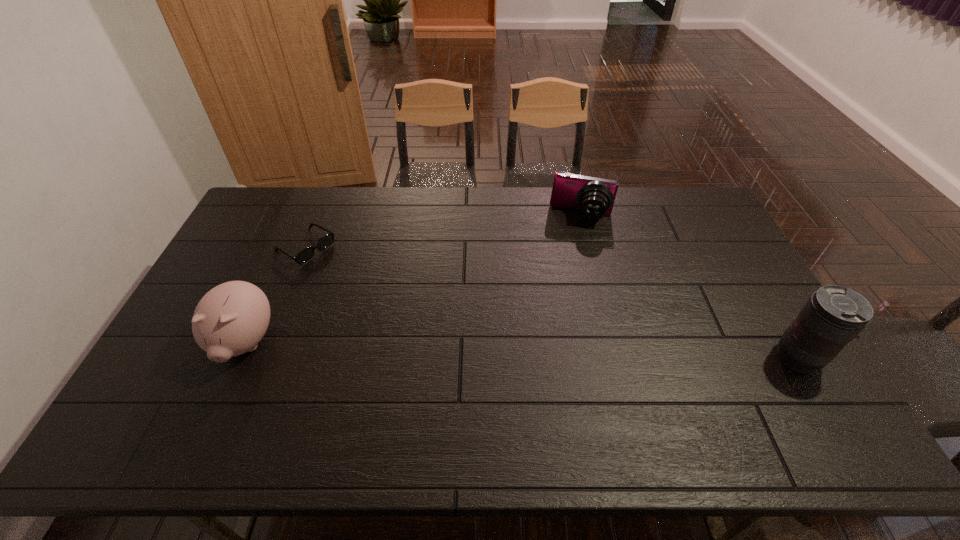
This screenshot has width=960, height=540. Find the location of `sunglasses situated at the left edge`. sunglasses situated at the left edge is located at coordinates (306, 254).

Locate an element on the screen. The image size is (960, 540). object at the right edge is located at coordinates tap(833, 316).

This screenshot has width=960, height=540. I want to click on object that is at the near left corner, so pyautogui.click(x=230, y=319).

The width and height of the screenshot is (960, 540). Find the location of `object present at the near right corner`. object present at the near right corner is located at coordinates (833, 316).

In order to click on blank space at the far edge of the desktop in this screenshot , I will do `click(309, 207)`.

This screenshot has width=960, height=540. I want to click on blank space at the near edge of the desktop, so click(444, 384).

You are a GUI agent. You are given a task and a screenshot of the screen. Output one action in this format:
    pyautogui.click(x=<x>, y=<y>)
    Task: Click on the free space at the left edge of the desktop
    The height and width of the screenshot is (540, 960).
    Given the screenshot: What is the action you would take?
    pyautogui.click(x=255, y=254)

The height and width of the screenshot is (540, 960). Find the location of `free space at the right edge of the desktop`. free space at the right edge of the desktop is located at coordinates (728, 251).

I want to click on vacant space at the near left corner of the desktop, so click(x=168, y=382).

Find the location of a particular element. blank area at the near right corner is located at coordinates (751, 392).